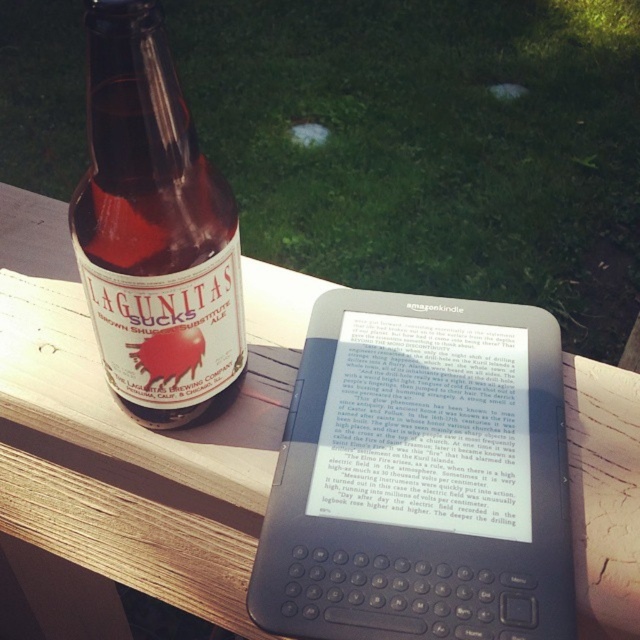
Question: Which point appears farthest from the camera in this image?

Choices:
 (A) (104, 243)
 (B) (186, 582)
 (C) (548, 499)

Answer: (B)

Question: Which of the following is the farthest from the observer?

Choices:
 (A) brown glass bottle at left
 (B) black plastic kindle at center
 (C) wooden bench at upper left

Answer: (C)

Question: Can you confirm if black plastic kindle at center is smaller than wooden bench at upper left?

Choices:
 (A) no
 (B) yes

Answer: (B)

Question: Can you confirm if wooden bench at upper left is bigger than brown glass bottle at left?

Choices:
 (A) yes
 (B) no

Answer: (A)

Question: Estimate the real-world distances between objects in this image. Which object is closer to the black plastic kindle at center?

Choices:
 (A) wooden bench at upper left
 (B) brown glass bottle at left

Answer: (B)

Question: Is wooden bench at upper left smaller than brown glass bottle at left?

Choices:
 (A) no
 (B) yes

Answer: (A)